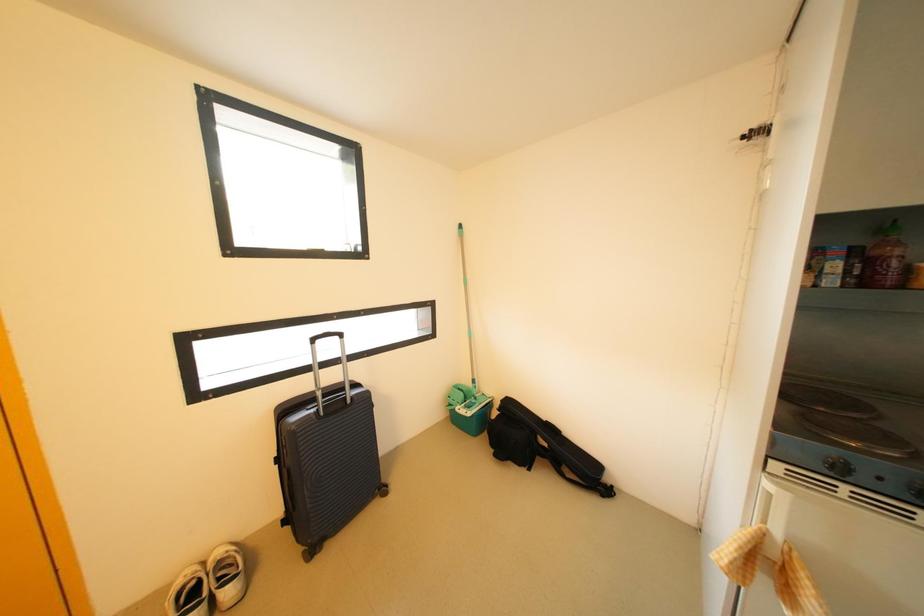
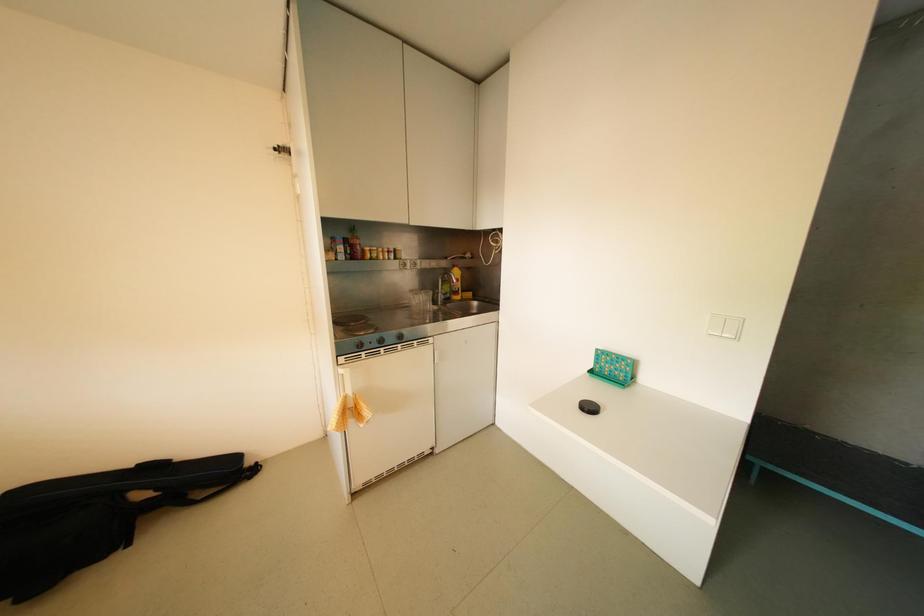
Question: The camera is either moving clockwise (left) or counter-clockwise (right) around the object. The first image is from the beginning of the video and the second image is from the end. Is the camera moving left or right when shooting the video?

Choices:
 (A) Left
 (B) Right

Answer: (A)